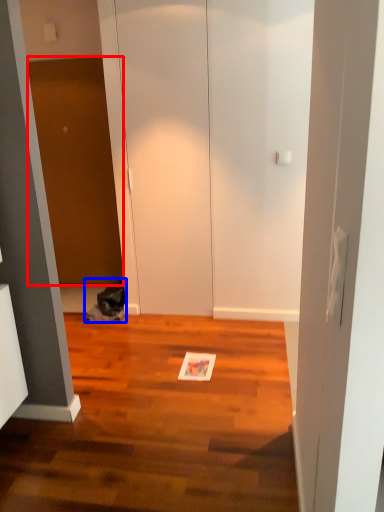
Question: Among these objects, which one is farthest to the camera, door (highlighted by a red box) or cat (highlighted by a blue box)?

Choices:
 (A) door
 (B) cat

Answer: (A)